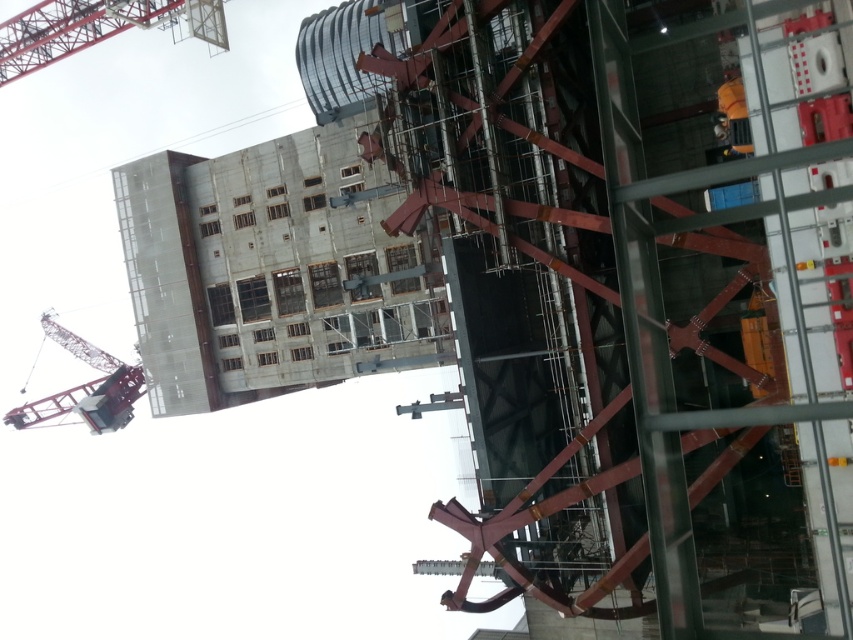
You are an inspector at the construction site and need to determine the spatial relationship between the metallic scaffolding at upper left and the metallic gray crane at upper left. Which one is positioned higher in the image?

The metallic scaffolding at upper left is above the metallic gray crane at upper left, so it is positioned higher.